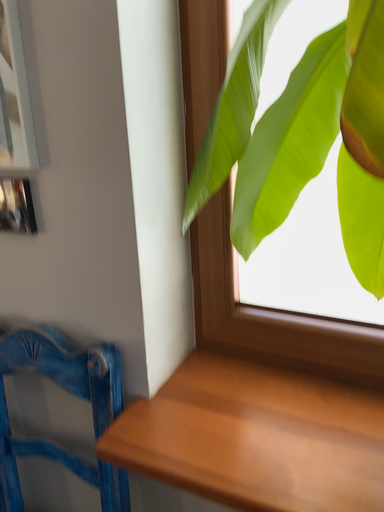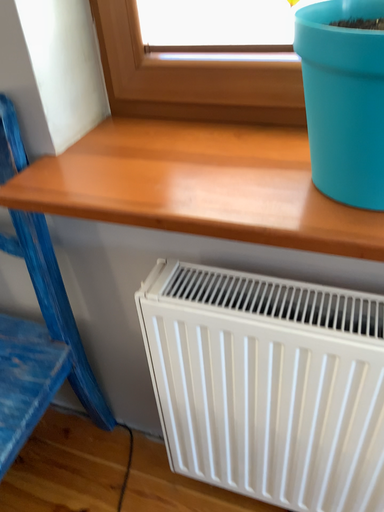
Question: Which way did the camera rotate in the video?

Choices:
 (A) rotated downward
 (B) rotated upward

Answer: (A)